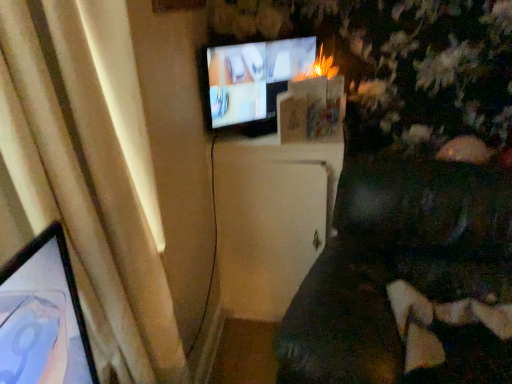
Question: Does beige fabric curtain at left appear on the left side of matte black tv at upper center?

Choices:
 (A) no
 (B) yes

Answer: (B)

Question: Can you confirm if beige fabric curtain at left is smaller than matte black tv at upper center?

Choices:
 (A) yes
 (B) no

Answer: (B)

Question: Is beige fabric curtain at left outside matte black tv at upper center?

Choices:
 (A) yes
 (B) no

Answer: (A)

Question: Can matte black tv at upper center be found inside beige fabric curtain at left?

Choices:
 (A) yes
 (B) no

Answer: (B)

Question: From the image's perspective, is beige fabric curtain at left located above matte black tv at upper center?

Choices:
 (A) yes
 (B) no

Answer: (B)

Question: Is beige fabric curtain at left further to camera compared to matte black tv at upper center?

Choices:
 (A) yes
 (B) no

Answer: (B)

Question: Does white matte cabinet at center touch matte black tv at upper center?

Choices:
 (A) yes
 (B) no

Answer: (B)

Question: Can you confirm if white matte cabinet at center is bigger than matte black tv at upper center?

Choices:
 (A) yes
 (B) no

Answer: (A)

Question: From a real-world perspective, is white matte cabinet at center under matte black tv at upper center?

Choices:
 (A) yes
 (B) no

Answer: (A)

Question: Is white matte cabinet at center looking in the opposite direction of matte black tv at upper center?

Choices:
 (A) yes
 (B) no

Answer: (B)

Question: Is white matte cabinet at center oriented towards matte black tv at upper center?

Choices:
 (A) yes
 (B) no

Answer: (B)

Question: Is matte black tv at upper center inside white matte cabinet at center?

Choices:
 (A) yes
 (B) no

Answer: (B)

Question: Would you say matte black tv at upper center contains beige fabric curtain at left?

Choices:
 (A) yes
 (B) no

Answer: (B)